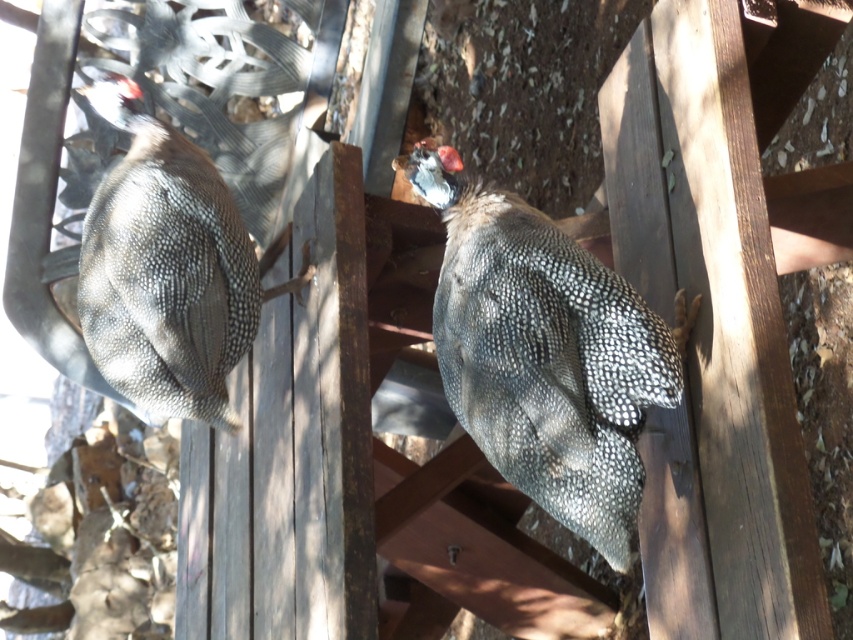
Question: From the image, what is the correct spatial relationship of pearlized feathered chicken at center in relation to speckled feathered chicken at left?

Choices:
 (A) above
 (B) below

Answer: (B)

Question: Among these points, which one is nearest to the camera?

Choices:
 (A) (177, 285)
 (B) (669, 333)

Answer: (B)

Question: Is pearlized feathered chicken at center above speckled feathered chicken at left?

Choices:
 (A) yes
 (B) no

Answer: (B)

Question: Considering the relative positions of pearlized feathered chicken at center and speckled feathered chicken at left in the image provided, where is pearlized feathered chicken at center located with respect to speckled feathered chicken at left?

Choices:
 (A) above
 (B) below

Answer: (B)

Question: Among these objects, which one is farthest from the camera?

Choices:
 (A) pearlized feathered chicken at center
 (B) speckled feathered chicken at left

Answer: (B)